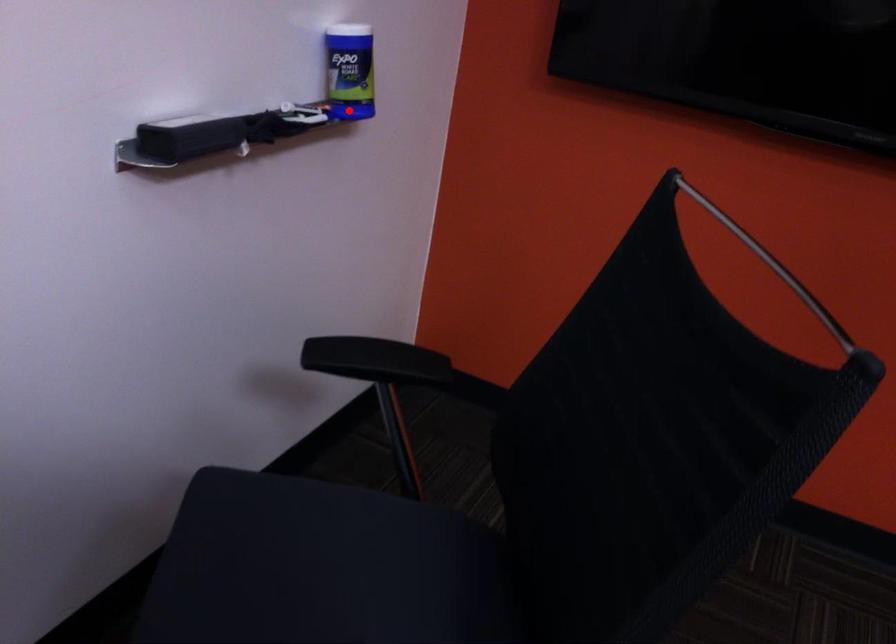
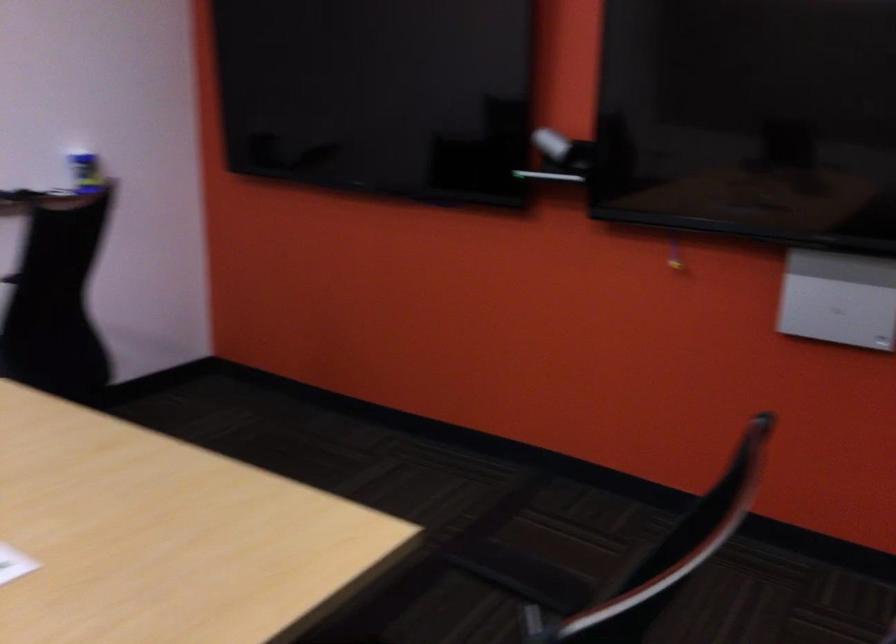
Question: I am providing you with two images of the same scene from different viewpoints. A red point is shown in image1. For the corresponding object point in image2, is it positioned nearer or farther from the camera?

Choices:
 (A) Nearer
 (B) Farther

Answer: (B)